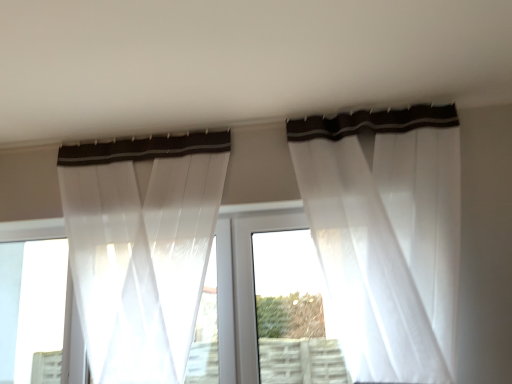
Question: Is sheer white curtain at upper center, which appears as the 2th curtain when viewed from the left, at the back of white plastic window frame at center?

Choices:
 (A) yes
 (B) no

Answer: (B)

Question: Considering the relative sizes of white plastic window frame at center and sheer white curtain at upper center, which appears as the 2th curtain when viewed from the left, in the image provided, is white plastic window frame at center smaller than sheer white curtain at upper center, which appears as the 2th curtain when viewed from the left,?

Choices:
 (A) yes
 (B) no

Answer: (A)

Question: Is the depth of white plastic window frame at center less than that of sheer white curtain at upper center, which appears as the 2th curtain when viewed from the left?

Choices:
 (A) no
 (B) yes

Answer: (A)

Question: Can you confirm if white plastic window frame at center is positioned to the left of sheer white curtain at upper center, positioned as the first curtain in right-to-left order?

Choices:
 (A) no
 (B) yes

Answer: (B)

Question: Is white plastic window frame at center at the right side of sheer white curtain at upper center, positioned as the first curtain in right-to-left order?

Choices:
 (A) no
 (B) yes

Answer: (A)

Question: Is white plastic window frame at center thinner than sheer white curtain at upper center, which appears as the 2th curtain when viewed from the left?

Choices:
 (A) yes
 (B) no

Answer: (A)

Question: Does sheer white curtain at left, placed as the second curtain when sorted from right to left, have a larger size compared to sheer white curtain at upper center, positioned as the first curtain in right-to-left order?

Choices:
 (A) no
 (B) yes

Answer: (A)

Question: Is sheer white curtain at left, placed as the second curtain when sorted from right to left, placed right next to sheer white curtain at upper center, positioned as the first curtain in right-to-left order?

Choices:
 (A) yes
 (B) no

Answer: (B)

Question: From the image's perspective, is sheer white curtain at left, placed as the 1th curtain when sorted from left to right, over sheer white curtain at upper center, positioned as the first curtain in right-to-left order?

Choices:
 (A) no
 (B) yes

Answer: (A)

Question: Is sheer white curtain at left, placed as the 1th curtain when sorted from left to right, taller than sheer white curtain at upper center, positioned as the first curtain in right-to-left order?

Choices:
 (A) yes
 (B) no

Answer: (B)

Question: Is sheer white curtain at left, placed as the second curtain when sorted from right to left, positioned in front of sheer white curtain at upper center, positioned as the first curtain in right-to-left order?

Choices:
 (A) no
 (B) yes

Answer: (A)

Question: Is sheer white curtain at left, placed as the second curtain when sorted from right to left, located outside sheer white curtain at upper center, positioned as the first curtain in right-to-left order?

Choices:
 (A) no
 (B) yes

Answer: (B)

Question: Is sheer white curtain at upper center, which appears as the 2th curtain when viewed from the left, turned away from white plastic window frame at center?

Choices:
 (A) no
 (B) yes

Answer: (A)